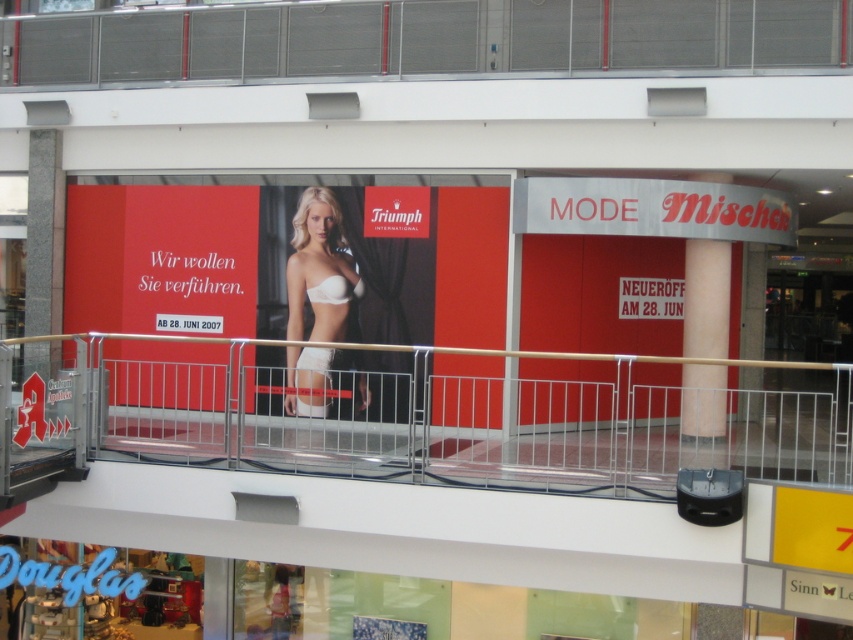
Is matte red poster at upper center below white matte lingerie at center?

No.

Does matte red poster at upper center have a greater height compared to white matte lingerie at center?

Correct, matte red poster at upper center is much taller as white matte lingerie at center.

Measure the distance between matte red poster at upper center and camera.

They are 37.32 feet apart.

Where is `matte red poster at upper center`? This screenshot has height=640, width=853. matte red poster at upper center is located at coordinates (161, 259).

Is point (173, 266) behind point (683, 310)?

That is True.

Does point (74, 288) come closer to viewer compared to point (709, 316)?

No.

In order to click on matte red poster at upper center in this screenshot , I will do `click(161, 259)`.

Can you confirm if metallic silver railing at center is thinner than matte red poster at upper center?

Yes.

Does metallic silver railing at center appear under matte red poster at upper center?

Correct, metallic silver railing at center is located below matte red poster at upper center.

Is point (344, 442) closer to viewer compared to point (202, 218)?

Yes, it is.

Locate an element on the screen. The height and width of the screenshot is (640, 853). metallic silver railing at center is located at coordinates (431, 416).